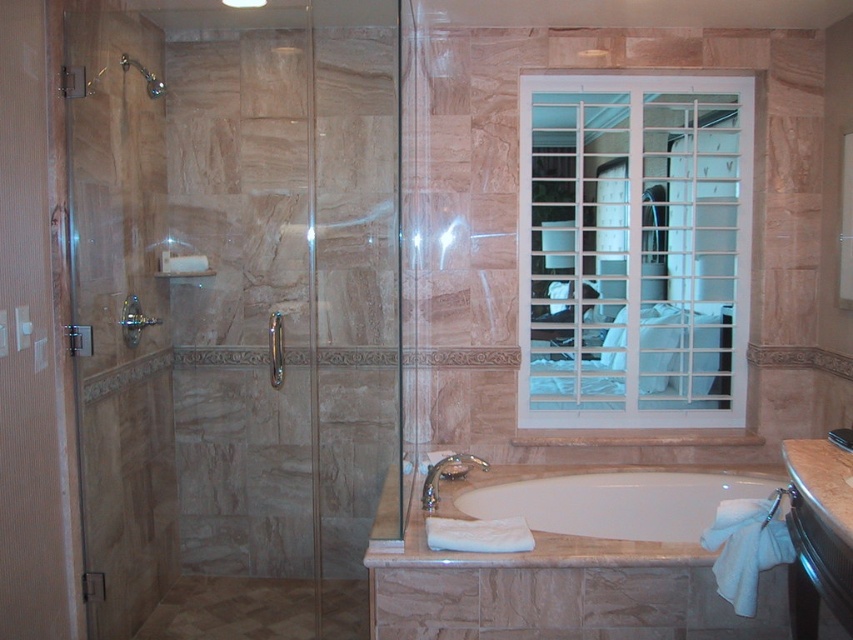
Who is higher up, transparent glass shower door at left or clear glass door at left?

Positioned higher is transparent glass shower door at left.

I want to click on transparent glass shower door at left, so click(x=233, y=316).

Find the location of `transparent glass shower door at left`. transparent glass shower door at left is located at coordinates (233, 316).

Does clear glass door at left have a greater height compared to white glossy bathtub at center?

Yes.

Which of these two, clear glass door at left or white glossy bathtub at center, stands shorter?

white glossy bathtub at center

Locate an element on the screen. clear glass door at left is located at coordinates (33, 337).

Can you confirm if white grid window at upper center is positioned above brushed metal showerhead at upper left?

No, white grid window at upper center is not above brushed metal showerhead at upper left.

Is white grid window at upper center thinner than brushed metal showerhead at upper left?

No.

Between point (616, 412) and point (131, 60), which one is positioned in front?

Point (131, 60) is in front.

I want to click on white grid window at upper center, so click(x=634, y=250).